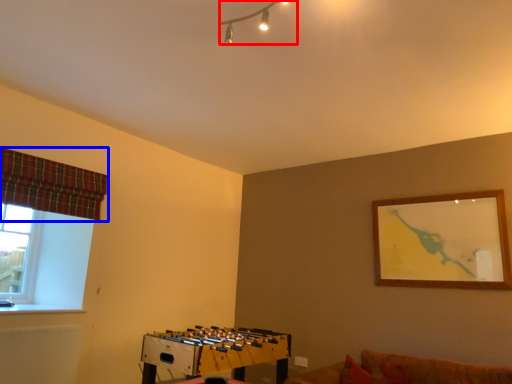
Question: Among these objects, which one is nearest to the camera, lamp (highlighted by a red box) or curtain (highlighted by a blue box)?

Choices:
 (A) lamp
 (B) curtain

Answer: (A)